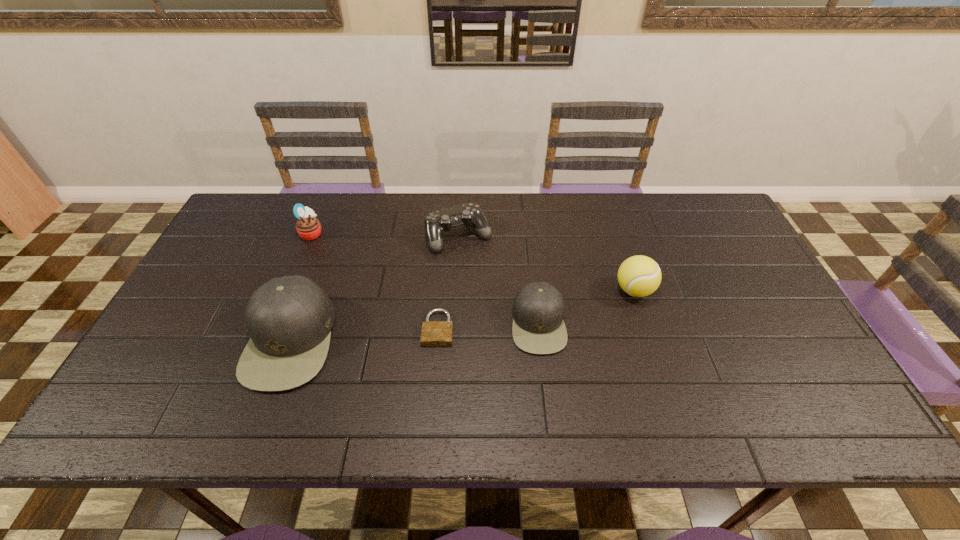
Please point a spot on the right to add another cap. Please provide its 2D coordinates. Your answer should be formatted as a tuple, i.e. [(x, y)], where the tuple contains the x and y coordinates of a point satisfying the conditions above.

[(771, 308)]